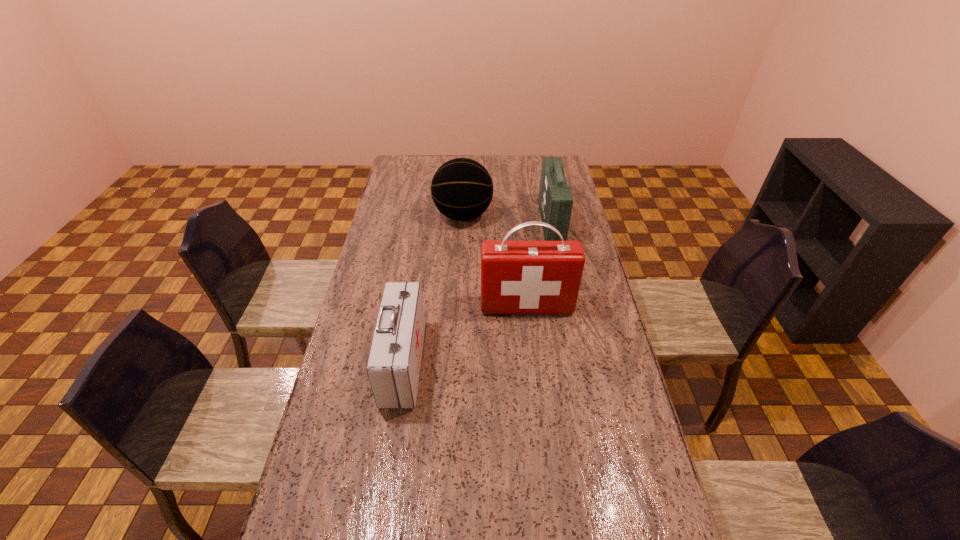
The height and width of the screenshot is (540, 960). In order to click on free space located 0.050m on the front-facing side of the farthest first-aid kit in this screenshot , I will do `click(530, 224)`.

Locate an element on the screen. The image size is (960, 540). vacant position located on the front-facing side of the shortest object is located at coordinates (516, 363).

Where is `object at the left edge`? This screenshot has height=540, width=960. object at the left edge is located at coordinates (393, 367).

This screenshot has width=960, height=540. In order to click on free region at the left edge of the desktop in this screenshot , I will do `click(397, 218)`.

The height and width of the screenshot is (540, 960). What are the coordinates of `blank area at the right edge` in the screenshot? It's located at (593, 298).

In the image, there is a desktop. Identify the location of vacant space at the far right corner. (539, 170).

I want to click on free spot between the farthest first-aid kit and the shortest first-aid kit, so click(477, 293).

The width and height of the screenshot is (960, 540). Identify the location of vacant area that lies between the nearest object and the second farthest first-aid kit. (466, 334).

Locate an element on the screen. The width and height of the screenshot is (960, 540). vacant space that's between the shortest object and the farthest first-aid kit is located at coordinates (477, 293).

Identify the location of vacant point located between the basketball and the farthest first-aid kit. The width and height of the screenshot is (960, 540). (507, 219).